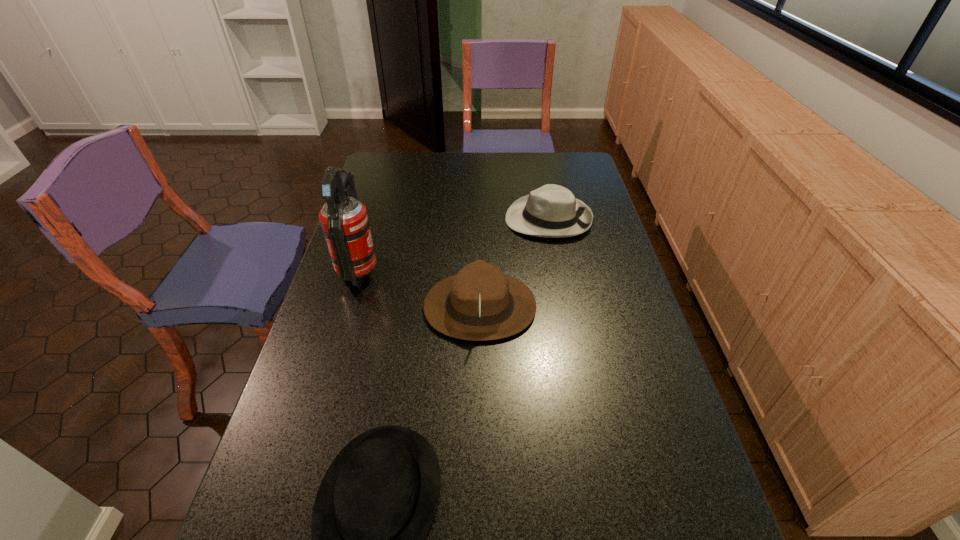
Select which fedora appears as the closest to the fire extinguisher. Please provide its 2D coordinates. Your answer should be formatted as a tuple, i.e. [(x, y)], where the tuple contains the x and y coordinates of a point satisfying the conditions above.

[(480, 303)]

This screenshot has width=960, height=540. I want to click on fedora that is the second nearest to the nearest fedora, so click(552, 211).